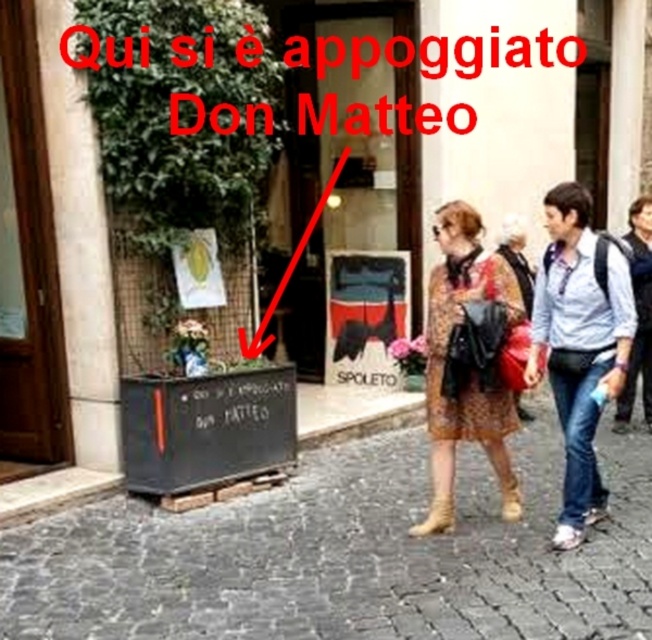
Can you confirm if blue denim jeans at lower right is smaller than matte brown dress at center?

Indeed, blue denim jeans at lower right has a smaller size compared to matte brown dress at center.

Can you confirm if blue denim jeans at lower right is positioned below matte brown dress at center?

Yes, blue denim jeans at lower right is below matte brown dress at center.

The height and width of the screenshot is (640, 652). What do you see at coordinates (580, 344) in the screenshot?
I see `blue denim jeans at lower right` at bounding box center [580, 344].

Find the location of a particular element. This screenshot has height=640, width=652. blue denim jeans at lower right is located at coordinates (580, 344).

Is cobblestone pavement at lower center positioned in front of brown suede boot at lower center?

Yes, cobblestone pavement at lower center is in front of brown suede boot at lower center.

Describe the element at coordinates (346, 556) in the screenshot. The height and width of the screenshot is (640, 652). I see `cobblestone pavement at lower center` at that location.

You are a GUI agent. You are given a task and a screenshot of the screen. Output one action in this format:
    pyautogui.click(x=<x>, y=<y>)
    Task: Click on the cobblestone pavement at lower center
    The height and width of the screenshot is (640, 652).
    Given the screenshot: What is the action you would take?
    pyautogui.click(x=346, y=556)

How distant is printed fabric dress at center from leather boot at lower center?

14.73 inches

Between printed fabric dress at center and leather boot at lower center, which one has less height?

With less height is leather boot at lower center.

Between point (496, 273) and point (451, 513), which one is positioned in front?

Point (496, 273) is more forward.

Where is `printed fabric dress at center`? The width and height of the screenshot is (652, 640). printed fabric dress at center is located at coordinates (467, 369).